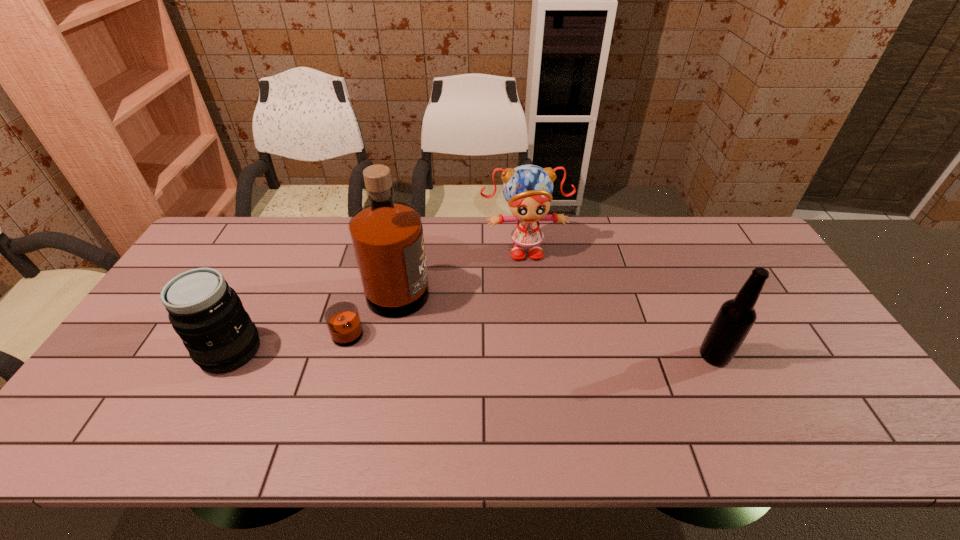
Identify the location of telephoto lens. (207, 314).

Where is `the shortest object`? the shortest object is located at coordinates (207, 314).

The image size is (960, 540). What are the coordinates of `beer bottle` in the screenshot? It's located at (734, 320).

The image size is (960, 540). In order to click on the second object from left to right in this screenshot , I will do coord(387,237).

Where is `the tallest object`? the tallest object is located at coordinates click(387, 237).

At what (x,y) coordinates should I click in order to perform the action: click on doll. Please return your answer as a coordinate pair (x, y). Looking at the image, I should click on (528, 189).

Identify the location of the farthest object. This screenshot has height=540, width=960. (528, 189).

Identify the location of vacant space located on the back of the telephoto lens. The height and width of the screenshot is (540, 960). (279, 256).

This screenshot has width=960, height=540. Find the location of `vacant space located 0.140m on the back of the rightmost object`. vacant space located 0.140m on the back of the rightmost object is located at coordinates (690, 306).

Find the location of a particular element. vacant space situated 0.370m on the front label of the liquor is located at coordinates (540, 387).